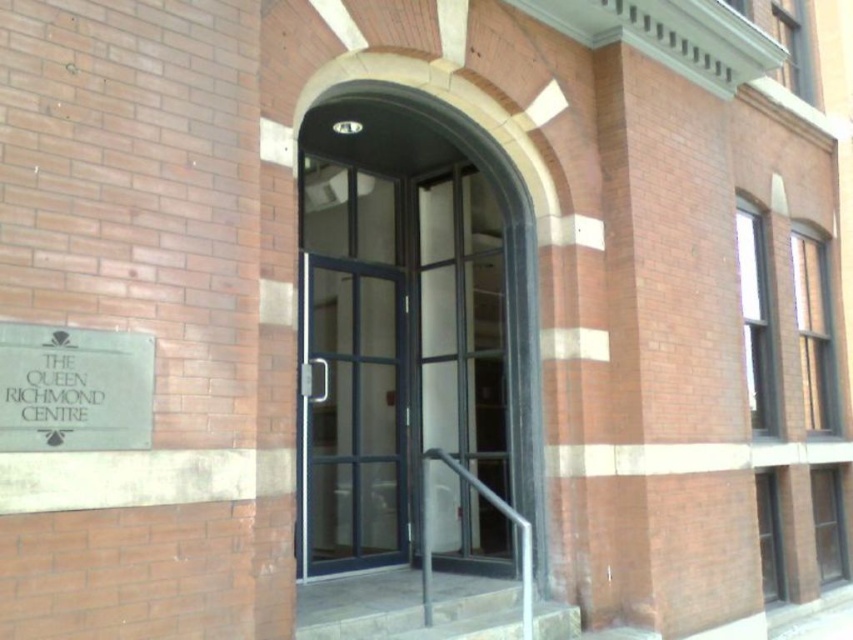
You are standing at the entrance of The Queen Richmond Centre and need to locate the silver metallic sign at lower left and the matte glass door at center. According to the scene description, which object is closer to you?

The silver metallic sign at lower left is closer to you because it is in front of the matte glass door at center.

You are a delivery person arriving at The Queen Richmond Centre. You need to locate the entrance to deliver a package. Which object should you approach first, the silver metallic sign at lower left or the matte glass door at center?

The silver metallic sign at lower left is positioned under the matte glass door at center, so you should approach the matte glass door at center first to enter the building.

You are a delivery person with a cart that is 1.2 meters wide. You need to deliver a package to the entrance of The Queen Richmond Centre. Can your cart fit through the space between the matte glass door at center and the gray concrete stairs at lower center?

The distance between the matte glass door at center and the gray concrete stairs at lower center is 1.02 meters, which is narrower than the cart width of 1.2 meters. Therefore, the cart cannot fit through that space.